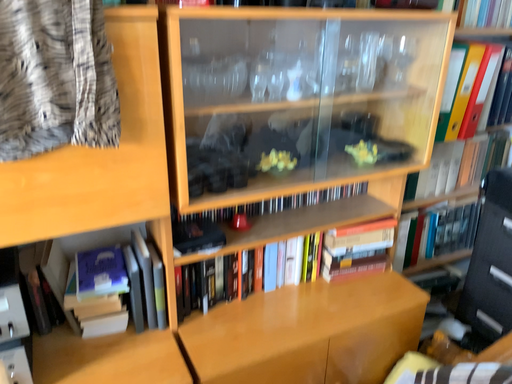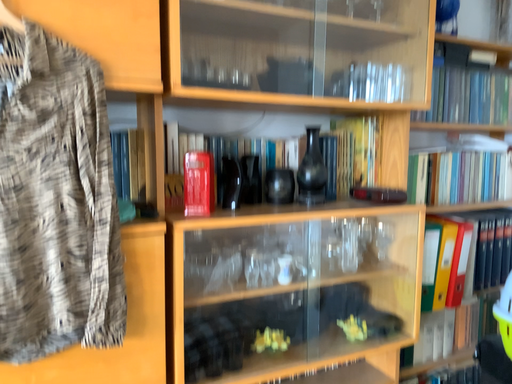
Question: How did the camera likely rotate when shooting the video?

Choices:
 (A) rotated upward
 (B) rotated downward

Answer: (A)